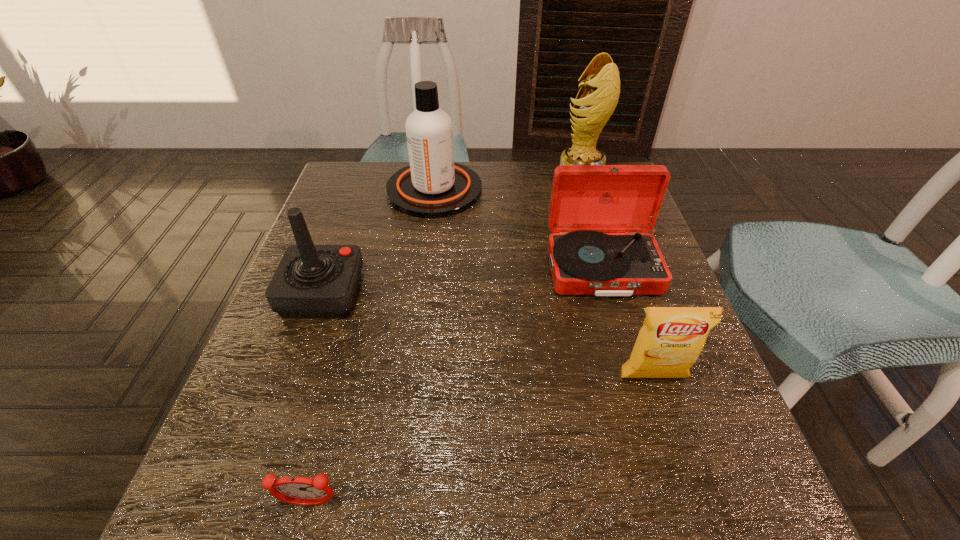
At what (x,y) coordinates should I click in order to perform the action: click on vacant space located 0.140m on the left of the cleansing agent. Please return your answer as a coordinate pair (x, y). Looking at the image, I should click on (337, 190).

At what (x,y) coordinates should I click in order to perform the action: click on vacant region located 0.160m on the front-facing side of the joystick. Please return your answer as a coordinate pair (x, y). The image size is (960, 540). Looking at the image, I should click on tap(434, 293).

Locate an element on the screen. Image resolution: width=960 pixels, height=540 pixels. blank space located on the front-facing side of the phonograph_record is located at coordinates (670, 500).

Find the location of a particular element. The height and width of the screenshot is (540, 960). free point located on the front of the second nearest object with the logo is located at coordinates (670, 430).

Identify the location of award at the far edge. (600, 92).

I want to click on cleansing agent that is at the far edge, so click(x=433, y=186).

At what (x,y) coordinates should I click in order to perform the action: click on object that is at the near edge. Please return your answer as a coordinate pair (x, y). The height and width of the screenshot is (540, 960). Looking at the image, I should click on (296, 490).

Locate an element on the screen. Image resolution: width=960 pixels, height=540 pixels. cleansing agent at the left edge is located at coordinates coord(433,186).

Identify the location of joystick that is at the left edge. (311, 280).

Where is `alarm clock located in the left edge section of the desktop`? alarm clock located in the left edge section of the desktop is located at coordinates pos(296,490).